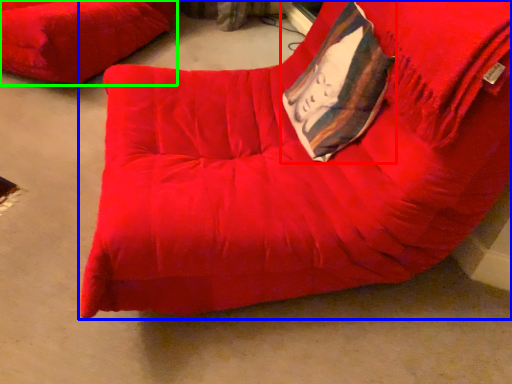
Question: Which object is the farthest from throw pillow (highlighted by a red box)? Choose among these: furniture (highlighted by a blue box) or furniture (highlighted by a green box).

Choices:
 (A) furniture
 (B) furniture

Answer: (B)